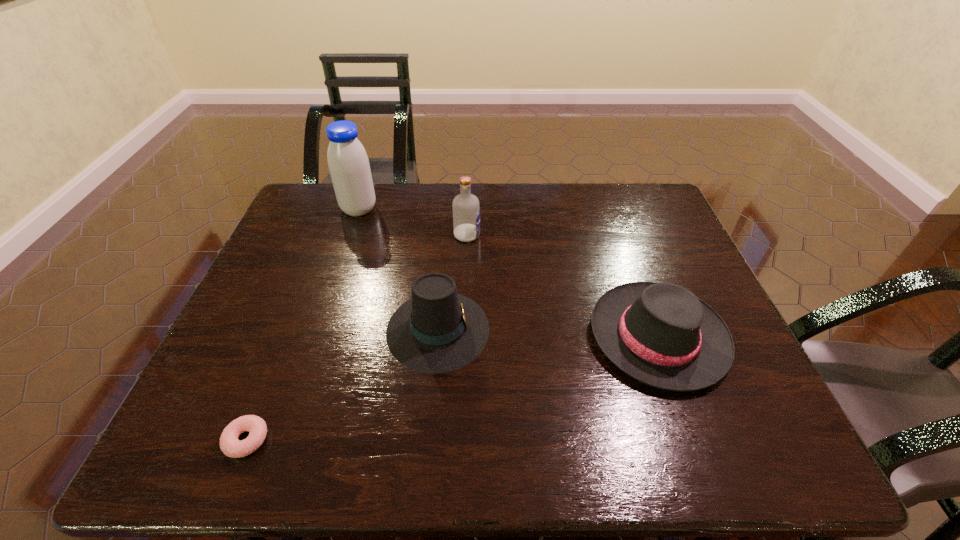
In order to click on the tallest object in this screenshot , I will do `click(348, 163)`.

The width and height of the screenshot is (960, 540). What are the coordinates of `the farthest object` in the screenshot? It's located at (348, 163).

The height and width of the screenshot is (540, 960). Identify the location of the second tallest object. (466, 208).

I want to click on the fourth nearest object, so click(x=466, y=208).

Image resolution: width=960 pixels, height=540 pixels. I want to click on the left dress hat, so click(438, 330).

At what (x,y) coordinates should I click in order to perform the action: click on the third tallest object. Please return your answer as a coordinate pair (x, y). The width and height of the screenshot is (960, 540). Looking at the image, I should click on (438, 330).

Identify the location of the shorter dress hat. This screenshot has width=960, height=540. (661, 334).

Locate an element on the screen. The image size is (960, 540). the right dress hat is located at coordinates (661, 334).

The height and width of the screenshot is (540, 960). Identify the location of doughnut. 230,445.

Find the location of `the nearest object`. the nearest object is located at coordinates (230, 445).